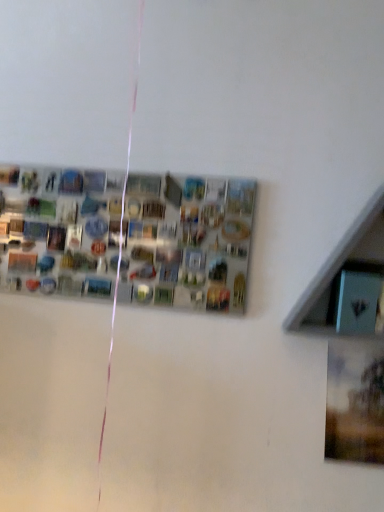
The image size is (384, 512). Describe the element at coordinates (126, 236) in the screenshot. I see `metallic silver bulletin board at center` at that location.

Image resolution: width=384 pixels, height=512 pixels. What are the coordinates of `metallic silver bulletin board at center` in the screenshot? It's located at (126, 236).

The width and height of the screenshot is (384, 512). What are the coordinates of `blue glossy shelf at upper right` in the screenshot? It's located at (348, 282).

The image size is (384, 512). Describe the element at coordinates (348, 282) in the screenshot. I see `blue glossy shelf at upper right` at that location.

Measure the distance between point (352,265) and camera.

The distance of point (352,265) from camera is 1.05 meters.

This screenshot has width=384, height=512. Identify the location of metallic silver bulletin board at center. (126, 236).

Based on their positions, is blue glossy shelf at upper right located to the left or right of metallic silver bulletin board at center?

From the image, it's evident that blue glossy shelf at upper right is to the right of metallic silver bulletin board at center.

Is blue glossy shelf at upper right closer to camera compared to metallic silver bulletin board at center?

Yes, blue glossy shelf at upper right is closer to the camera.

Which is behind, point (341, 331) or point (161, 250)?

The point (161, 250) is farther from the camera.

From the image's perspective, between blue glossy shelf at upper right and metallic silver bulletin board at center, who is located below?

blue glossy shelf at upper right is shown below in the image.

From a real-world perspective, is blue glossy shelf at upper right physically located above or below metallic silver bulletin board at center?

From a real-world perspective, blue glossy shelf at upper right is physically above metallic silver bulletin board at center.

Between blue glossy shelf at upper right and metallic silver bulletin board at center, which one has smaller width?

metallic silver bulletin board at center.

Can you confirm if blue glossy shelf at upper right is shorter than metallic silver bulletin board at center?

In fact, blue glossy shelf at upper right may be taller than metallic silver bulletin board at center.

Based on the photo, can you confirm if blue glossy shelf at upper right is smaller than metallic silver bulletin board at center?

Incorrect, blue glossy shelf at upper right is not smaller in size than metallic silver bulletin board at center.

Is blue glossy shelf at upper right located outside metallic silver bulletin board at center?

Yes, blue glossy shelf at upper right is not within metallic silver bulletin board at center.

Is blue glossy shelf at upper right placed right next to metallic silver bulletin board at center?

No, blue glossy shelf at upper right is not with metallic silver bulletin board at center.

Does blue glossy shelf at upper right turn towards metallic silver bulletin board at center?

No, blue glossy shelf at upper right does not turn towards metallic silver bulletin board at center.

This screenshot has height=512, width=384. Identify the location of shelf that is on the right side of metallic silver bulletin board at center. (348, 282).

Is metallic silver bulletin board at center to the left of blue glossy shelf at upper right from the viewer's perspective?

Yes, metallic silver bulletin board at center is to the left of blue glossy shelf at upper right.

Which is behind, metallic silver bulletin board at center or blue glossy shelf at upper right?

Positioned behind is metallic silver bulletin board at center.

Does point (21, 287) come closer to viewer compared to point (320, 300)?

No.

From the image's perspective, which is below, metallic silver bulletin board at center or blue glossy shelf at upper right?

From the image's view, blue glossy shelf at upper right is below.

From a real-world perspective, which is physically above, metallic silver bulletin board at center or blue glossy shelf at upper right?

In real-world perspective, blue glossy shelf at upper right is above.

Is metallic silver bulletin board at center thinner than blue glossy shelf at upper right?

Correct, the width of metallic silver bulletin board at center is less than that of blue glossy shelf at upper right.

In the scene shown: Can you confirm if metallic silver bulletin board at center is taller than blue glossy shelf at upper right?

No.

Considering the sizes of metallic silver bulletin board at center and blue glossy shelf at upper right in the image, is metallic silver bulletin board at center bigger or smaller than blue glossy shelf at upper right?

Clearly, metallic silver bulletin board at center is smaller in size than blue glossy shelf at upper right.

Is metallic silver bulletin board at center inside or outside of blue glossy shelf at upper right?

metallic silver bulletin board at center is located beyond the bounds of blue glossy shelf at upper right.

Is metallic silver bulletin board at center not close to blue glossy shelf at upper right?

metallic silver bulletin board at center is actually quite close to blue glossy shelf at upper right.

Does metallic silver bulletin board at center turn towards blue glossy shelf at upper right?

No, metallic silver bulletin board at center is not turned towards blue glossy shelf at upper right.

Find the location of a particular element. This screenshot has width=384, height=512. shelf in front of the metallic silver bulletin board at center is located at coordinates (348, 282).

Find the location of a particular element. The width and height of the screenshot is (384, 512). bulletin board located on the left of blue glossy shelf at upper right is located at coordinates point(126,236).

Find the location of `shelf in front of the metallic silver bulletin board at center`. shelf in front of the metallic silver bulletin board at center is located at coordinates (348, 282).